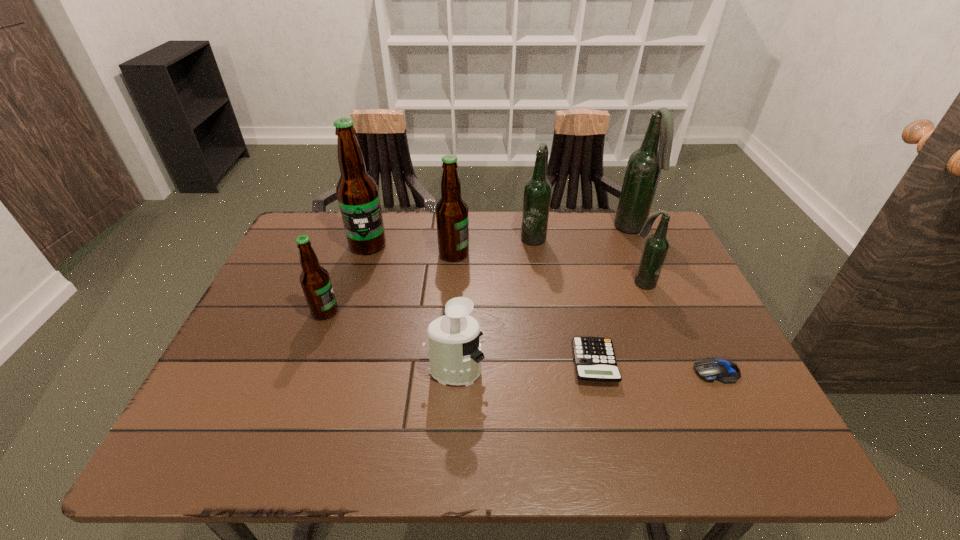
The height and width of the screenshot is (540, 960). Identify the location of blank space located 0.070m on the front of the sixth object from left to right. (608, 417).

Identify the location of free spot located 0.200m on the button side of the computer mouse. (601, 372).

This screenshot has width=960, height=540. What are the coordinates of `vacant space located on the button side of the computer mouse` in the screenshot? It's located at (518, 372).

Locate an element on the screen. The image size is (960, 540). vacant space situated 0.200m on the button side of the computer mouse is located at coordinates (601, 372).

The height and width of the screenshot is (540, 960). Identify the location of object at the left edge. (315, 281).

Where is `computer mouse that is at the right edge`? The width and height of the screenshot is (960, 540). computer mouse that is at the right edge is located at coordinates coord(710,369).

You are a GUI agent. You are given a task and a screenshot of the screen. Output one action in this format:
    pyautogui.click(x=<x>, y=<y>)
    Task: Click on the object that is positioned at the far right corner
    The width and height of the screenshot is (960, 540).
    Given the screenshot: What is the action you would take?
    pyautogui.click(x=644, y=167)

Find the location of a particular element. vacant space at the far edge is located at coordinates (426, 259).

In the image, there is a desktop. Where is `blank space at the near edge`? Image resolution: width=960 pixels, height=540 pixels. blank space at the near edge is located at coordinates pos(643,454).

Locate an element on the screen. Image resolution: width=960 pixels, height=540 pixels. free space at the left edge of the desktop is located at coordinates (302, 316).